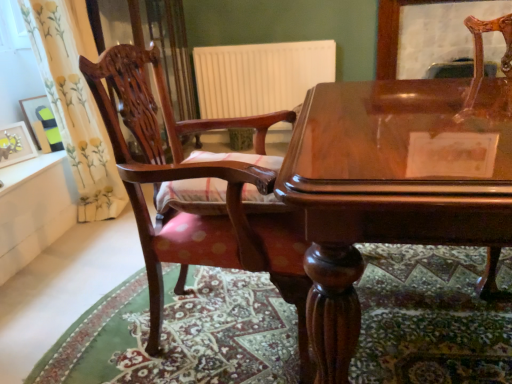
Question: Considering the relative sizes of glossy wood table at center and mahogany wood chair at left in the image provided, is glossy wood table at center smaller than mahogany wood chair at left?

Choices:
 (A) yes
 (B) no

Answer: (B)

Question: Is glossy wood table at center at the left side of mahogany wood chair at left?

Choices:
 (A) no
 (B) yes

Answer: (A)

Question: Does glossy wood table at center have a lesser width compared to mahogany wood chair at left?

Choices:
 (A) no
 (B) yes

Answer: (A)

Question: Is glossy wood table at center further to camera compared to mahogany wood chair at left?

Choices:
 (A) no
 (B) yes

Answer: (A)

Question: From the image's perspective, does glossy wood table at center appear higher than mahogany wood chair at left?

Choices:
 (A) yes
 (B) no

Answer: (B)

Question: In the image, is glossy wood table at center positioned in front of or behind mahogany wood chair at left?

Choices:
 (A) behind
 (B) front

Answer: (B)

Question: In the image, is glossy wood table at center on the left side or the right side of mahogany wood chair at left?

Choices:
 (A) left
 (B) right

Answer: (B)

Question: Is glossy wood table at center wider or thinner than mahogany wood chair at left?

Choices:
 (A) wide
 (B) thin

Answer: (A)

Question: From their relative heights in the image, would you say glossy wood table at center is taller or shorter than mahogany wood chair at left?

Choices:
 (A) short
 (B) tall

Answer: (A)

Question: Considering the positions of glossy wood table at center and carpeted floor at lower center in the image, is glossy wood table at center bigger or smaller than carpeted floor at lower center?

Choices:
 (A) small
 (B) big

Answer: (B)

Question: Does point (339, 87) appear closer or farther from the camera than point (432, 329)?

Choices:
 (A) closer
 (B) farther

Answer: (B)

Question: In terms of height, does glossy wood table at center look taller or shorter compared to carpeted floor at lower center?

Choices:
 (A) tall
 (B) short

Answer: (A)

Question: Is glossy wood table at center spatially inside carpeted floor at lower center, or outside of it?

Choices:
 (A) outside
 (B) inside

Answer: (A)

Question: From a real-world perspective, relative to floral fabric curtain at left, is matte yellow picture frame at left, the 2th picture frame in the back-to-front sequence, vertically above or below?

Choices:
 (A) below
 (B) above

Answer: (A)

Question: Choose the correct answer: Is matte yellow picture frame at left, which is the first picture frame from front to back, inside floral fabric curtain at left or outside it?

Choices:
 (A) outside
 (B) inside

Answer: (A)